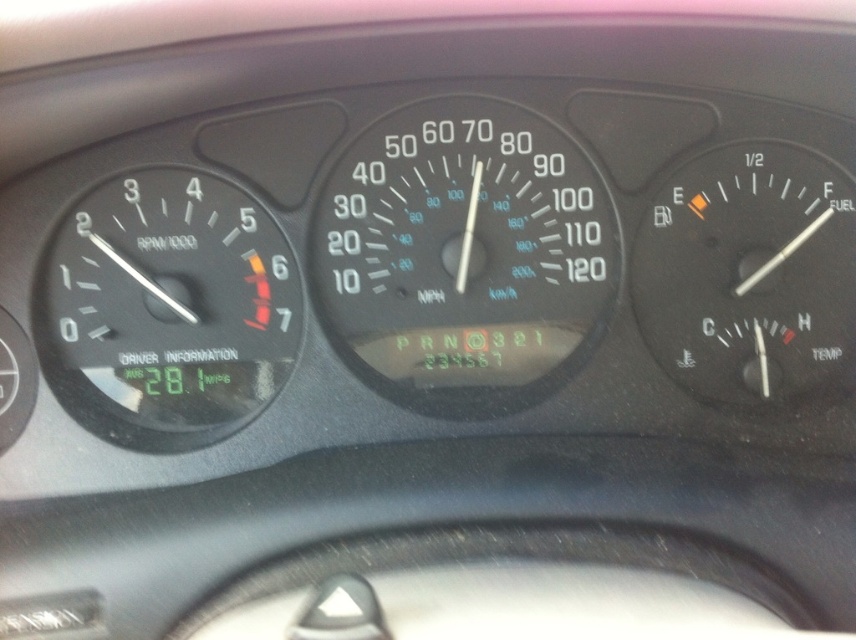
Does point (406, 170) come closer to viewer compared to point (767, 324)?

Yes, it is.

Can you confirm if white plastic speedometer at center is wider than transparent plastic fuel gauge at right?

Correct, the width of white plastic speedometer at center exceeds that of transparent plastic fuel gauge at right.

Where is `white plastic speedometer at center`? This screenshot has height=640, width=856. white plastic speedometer at center is located at coordinates (464, 256).

Does black plastic speedometer at left have a lesser width compared to transparent plastic fuel gauge at right?

No.

Image resolution: width=856 pixels, height=640 pixels. What are the coordinates of `black plastic speedometer at left` in the screenshot? It's located at (167, 308).

Find the location of `black plastic speedometer at left`. black plastic speedometer at left is located at coordinates (167, 308).

Consider the image. Is white plastic speedometer at center bigger than black plastic speedometer at left?

Correct, white plastic speedometer at center is larger in size than black plastic speedometer at left.

Between white plastic speedometer at center and black plastic speedometer at left, which one has more height?

white plastic speedometer at center is taller.

Locate an element on the screen. white plastic speedometer at center is located at coordinates (464, 256).

You are a GUI agent. You are given a task and a screenshot of the screen. Output one action in this format:
    pyautogui.click(x=<x>, y=<y>)
    Task: Click on the white plastic speedometer at center
    
    Given the screenshot: What is the action you would take?
    pyautogui.click(x=464, y=256)